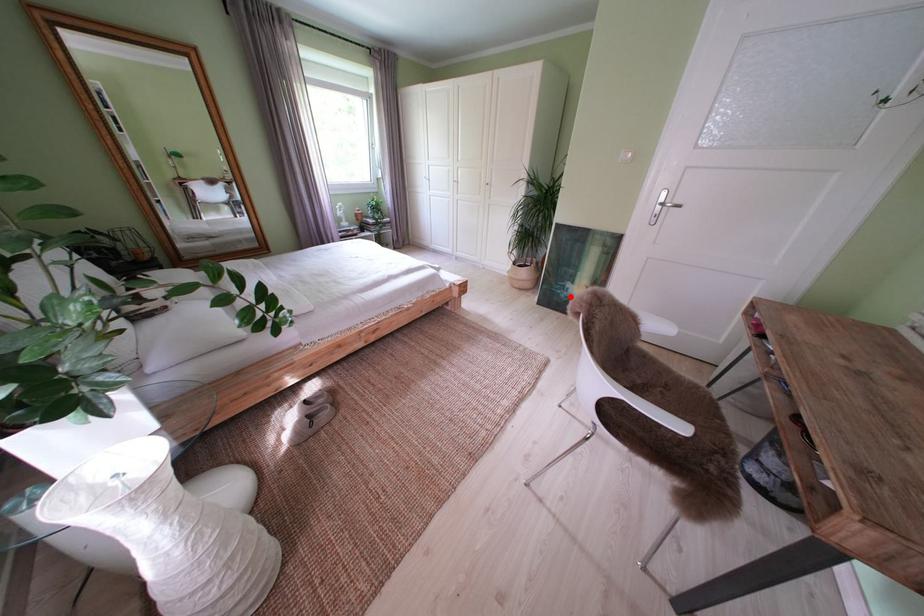
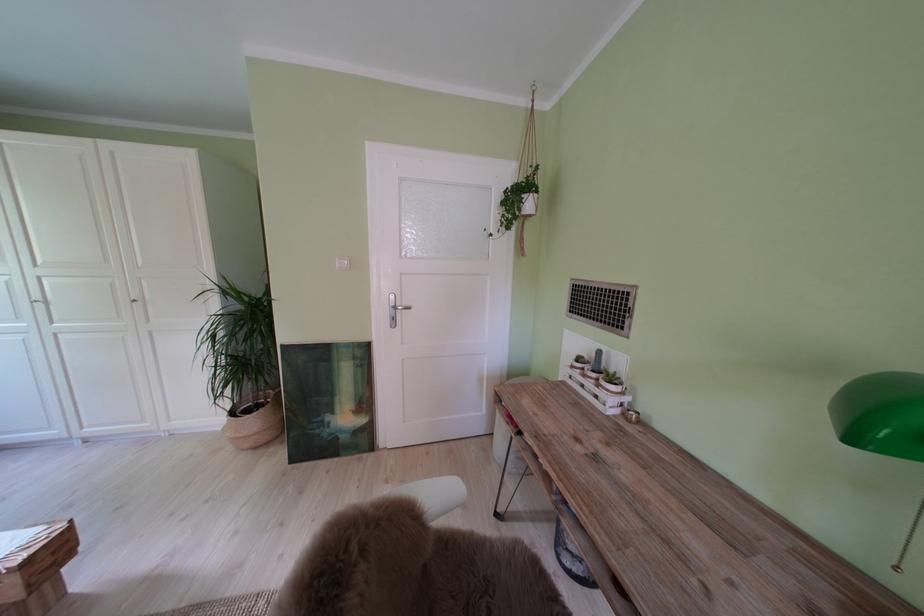
Question: I am providing you with two images of the same scene from different viewpoints. A red point is shown in image1. For the corresponding object point in image2, is it positioned nearer or farther from the camera?

Choices:
 (A) Nearer
 (B) Farther

Answer: (B)